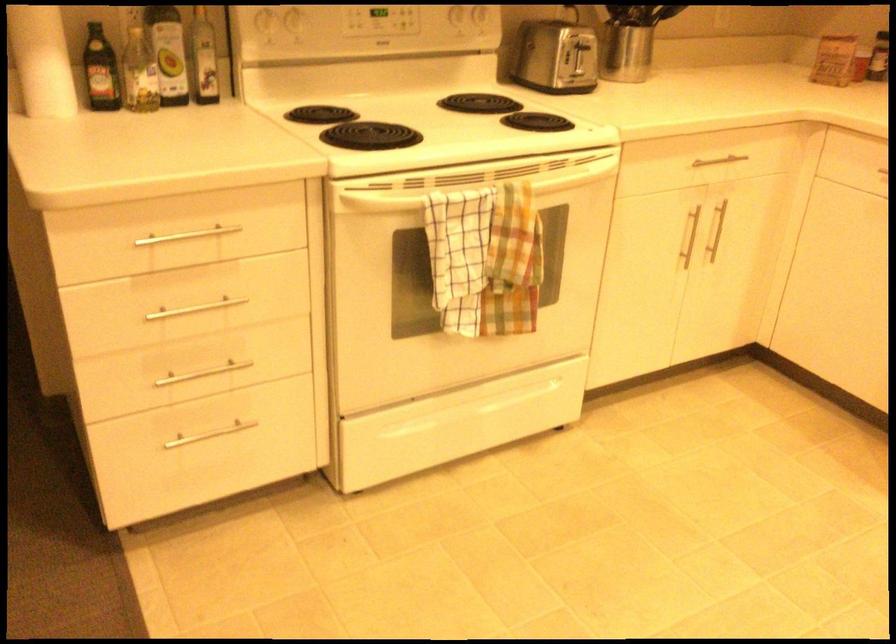
Image resolution: width=896 pixels, height=644 pixels. What are the coordinates of `toaster lever` in the screenshot? It's located at (572, 73).